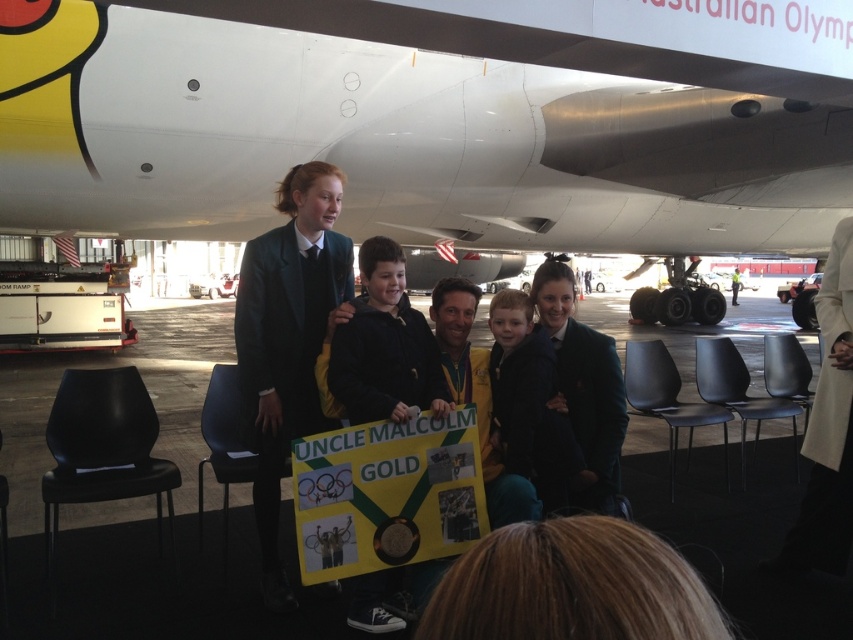
Does point (502, 513) come farther from viewer compared to point (581, 381)?

No, (502, 513) is in front of (581, 381).

Which of these two, gold medal at center or black woolen blazer at center, stands taller?

gold medal at center is taller.

Who is more forward, (450,308) or (584,362)?

Point (450,308) is more forward.

At what (x,y) coordinates should I click in order to perform the action: click on gold medal at center. Please return your answer as a coordinate pair (x, y). The image size is (853, 640). Looking at the image, I should click on (477, 397).

What are the coordinates of `metallic silver airplane at center` in the screenshot? It's located at (396, 140).

Is point (817, 196) less distant than point (277, 570)?

No, it is not.

The image size is (853, 640). Find the location of `metallic silver airplane at center`. metallic silver airplane at center is located at coordinates (396, 140).

Who is more forward, (672,131) or (436,284)?

Positioned in front is point (436,284).

Is metallic silver airplane at center further to the viewer compared to gold medal at center?

That is True.

This screenshot has width=853, height=640. Find the location of `metallic silver airplane at center`. metallic silver airplane at center is located at coordinates (396, 140).